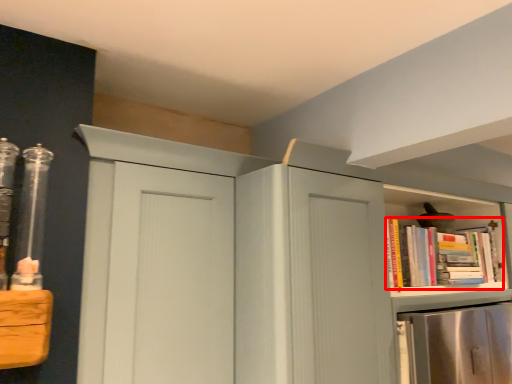
Question: Considering the relative positions of book (annotated by the red box) and cupboard in the image provided, where is book (annotated by the red box) located with respect to the staircase?

Choices:
 (A) right
 (B) left

Answer: (A)